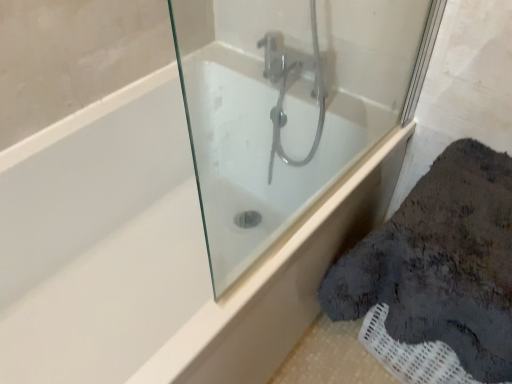
Question: Is white glossy bathtub at center inside the boundaries of white glossy bathtub at center, or outside?

Choices:
 (A) inside
 (B) outside

Answer: (B)

Question: Visually, is white glossy bathtub at center positioned to the left or to the right of white glossy bathtub at center?

Choices:
 (A) left
 (B) right

Answer: (B)

Question: Considering the positions of white glossy bathtub at center and white glossy bathtub at center in the image, is white glossy bathtub at center taller or shorter than white glossy bathtub at center?

Choices:
 (A) tall
 (B) short

Answer: (B)

Question: Considering the positions of white glossy bathtub at center and white glossy bathtub at center in the image, is white glossy bathtub at center wider or thinner than white glossy bathtub at center?

Choices:
 (A) thin
 (B) wide

Answer: (B)

Question: Is white glossy bathtub at center spatially inside white glossy bathtub at center, or outside of it?

Choices:
 (A) inside
 (B) outside

Answer: (B)

Question: Considering the relative positions of white glossy bathtub at center and white glossy bathtub at center in the image provided, is white glossy bathtub at center to the left or to the right of white glossy bathtub at center?

Choices:
 (A) right
 (B) left

Answer: (B)

Question: Is white glossy bathtub at center bigger or smaller than white glossy bathtub at center?

Choices:
 (A) small
 (B) big

Answer: (B)